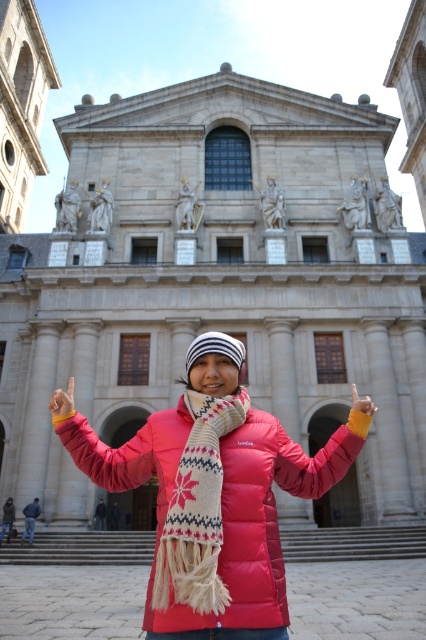
Can you confirm if matte pink down jacket at center is thinner than smooth yellow glove at center?

No.

Who is shorter, matte pink down jacket at center or smooth yellow glove at center?

With less height is smooth yellow glove at center.

Where is `matte pink down jacket at center`? matte pink down jacket at center is located at coordinates (215, 497).

Who is higher up, matte pink down jacket at center or white knitted scarf at center?

matte pink down jacket at center is higher up.

Does matte pink down jacket at center appear over white knitted scarf at center?

Correct, matte pink down jacket at center is located above white knitted scarf at center.

The height and width of the screenshot is (640, 426). Describe the element at coordinates (215, 497) in the screenshot. I see `matte pink down jacket at center` at that location.

Image resolution: width=426 pixels, height=640 pixels. Find the location of `matte pink down jacket at center`. matte pink down jacket at center is located at coordinates (215, 497).

Which is above, white knitted scarf at center or matte pink finger at center?

matte pink finger at center is above.

Identify the location of white knitted scarf at center. Image resolution: width=426 pixels, height=640 pixels. (198, 509).

Find the location of a particular element. white knitted scarf at center is located at coordinates (198, 509).